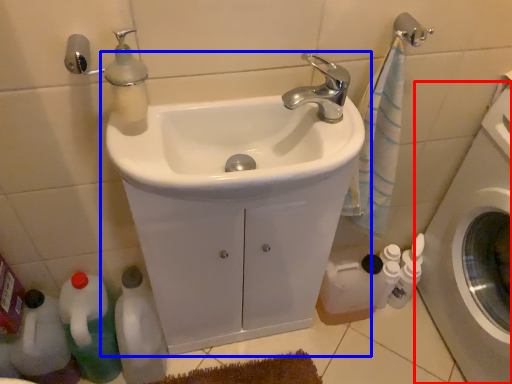
Question: Among these objects, which one is nearest to the camera, washing machine (highlighted by a red box) or sink (highlighted by a blue box)?

Choices:
 (A) washing machine
 (B) sink

Answer: (A)